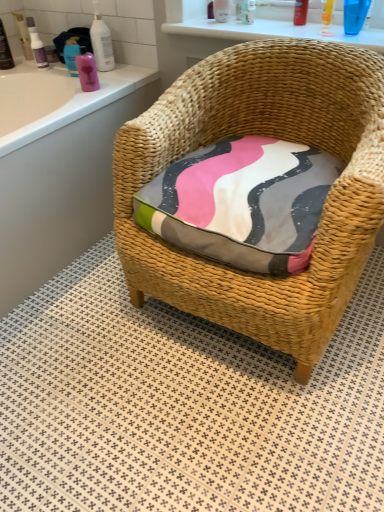
The height and width of the screenshot is (512, 384). I want to click on vacant region to the left of translucent plastic bottle at upper center, acting as the second toiletry starting from the right, so click(263, 26).